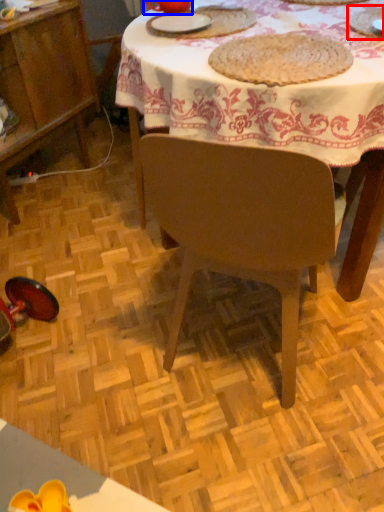
Question: Among these objects, which one is nearest to the camera, tableware (highlighted by a red box) or tableware (highlighted by a blue box)?

Choices:
 (A) tableware
 (B) tableware

Answer: (A)